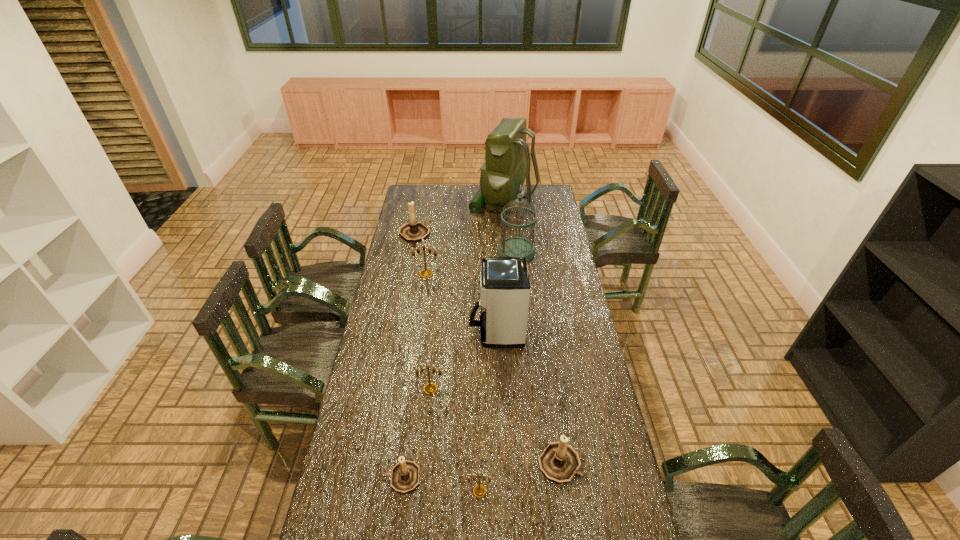
At what (x,y) coordinates should I click in order to perform the action: click on the rightmost brown candle holder. Please return your answer as a coordinate pair (x, y). This screenshot has height=540, width=960. Looking at the image, I should click on (559, 462).

This screenshot has width=960, height=540. I want to click on the rightmost candelabrum, so click(559, 462).

Where is `the smallest brown candle holder`? The image size is (960, 540). the smallest brown candle holder is located at coordinates (405, 475).

The height and width of the screenshot is (540, 960). Find the location of `the rightmost gold candelabrum`. the rightmost gold candelabrum is located at coordinates (479, 490).

Where is `the second candelabrum from right to left`? This screenshot has height=540, width=960. the second candelabrum from right to left is located at coordinates (479, 490).

Image resolution: width=960 pixels, height=540 pixels. I want to click on vacant space located on the front of the farthest object with visible pockets, so click(x=403, y=202).

This screenshot has height=540, width=960. In order to click on free spot located on the front of the farthest object with visible pockets in this screenshot , I will do `click(430, 202)`.

Find the location of a particular element. vacant region located 0.310m on the front of the farthest object with visible pockets is located at coordinates (417, 202).

You are a GUI agent. You are given a task and a screenshot of the screen. Output one action in this format:
    pyautogui.click(x=<x>, y=<y>)
    Task: Click on the vacant point located 0.170m on the front-facing side of the birdcage
    The image size is (960, 540).
    Given the screenshot: What is the action you would take?
    pyautogui.click(x=465, y=252)

Locate an element on the screen. This screenshot has width=960, height=540. blank space located 0.290m on the front-facing side of the birdcage is located at coordinates (442, 252).